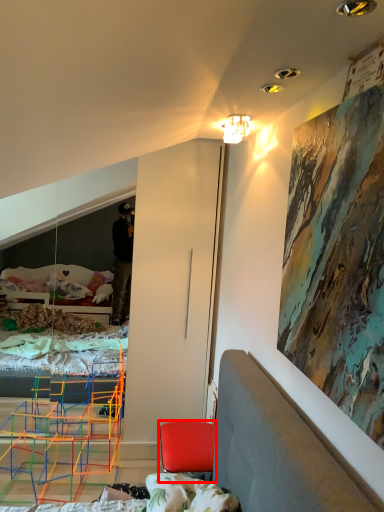
Question: From the image's perspective, what is the correct spatial positioning of chair (annotated by the red box) in reference to lamp?

Choices:
 (A) below
 (B) above

Answer: (A)